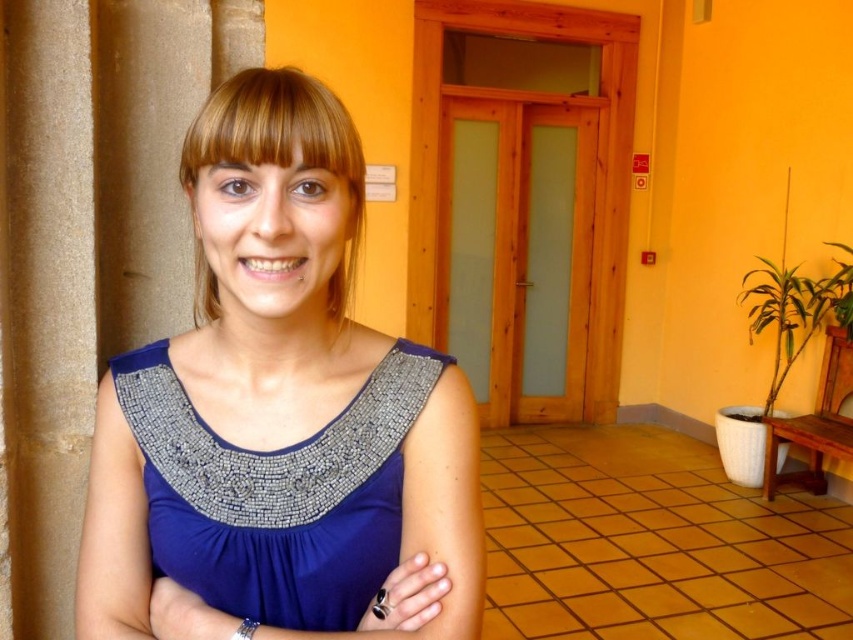
Question: Can you confirm if blue fabric dress at center is smaller than silver metallic bracelet at lower center?

Choices:
 (A) yes
 (B) no

Answer: (B)

Question: Can you confirm if blue fabric dress at center is positioned to the left of silver metallic bracelet at lower center?

Choices:
 (A) no
 (B) yes

Answer: (A)

Question: Does brown stone pillar at left have a larger size compared to silver metallic bracelet at lower center?

Choices:
 (A) no
 (B) yes

Answer: (B)

Question: Estimate the real-world distances between objects in this image. Which object is farther from the brown stone pillar at left?

Choices:
 (A) blue satin dress at center
 (B) blue fabric dress at center

Answer: (A)

Question: Which point is farther to the camera?

Choices:
 (A) silver metallic bracelet at lower center
 (B) blue satin dress at center
 (C) blue fabric dress at center
 (D) brown stone pillar at left

Answer: (D)

Question: Which object is closer to the camera taking this photo?

Choices:
 (A) blue fabric dress at center
 (B) brown stone pillar at left
 (C) blue satin dress at center

Answer: (A)